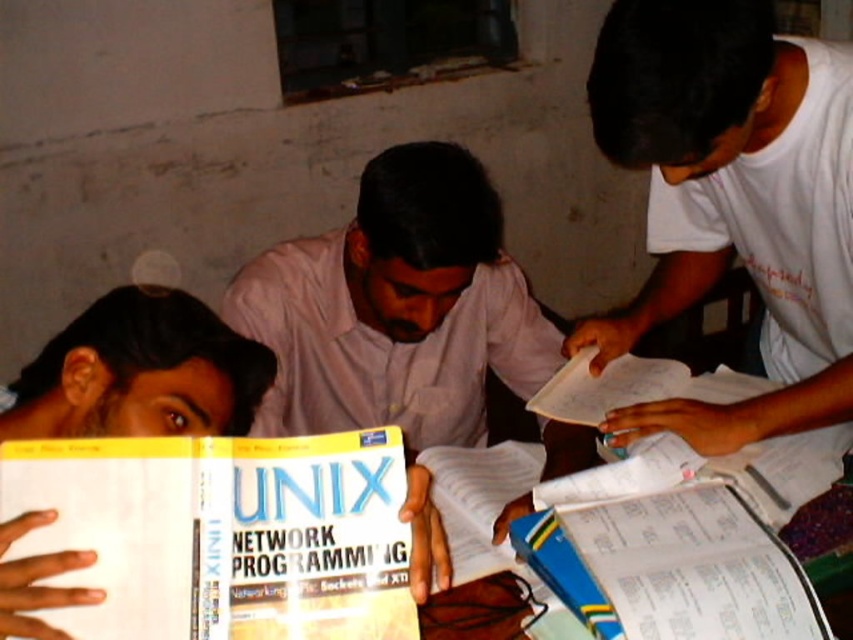
You are a photographer trying to capture the scene of the study session. You want to ensure that both the white matte shirt at upper right and the white paper book at center are clearly visible in your photo. Based on their positions, which object should you focus on first to ensure both are in frame?

The white matte shirt at upper right is positioned on the right side of the white paper book at center. Therefore, focusing on the white paper book at center first will ensure both objects remain in frame as the shirt is to its right.

You are a student sitting at a desk and you want to reach for the yellow paperback book at center. Can you comfortably reach it without moving your chair?

The yellow paperback book at center is 25.27 inches away from the viewer. Since the average comfortable reaching distance is about 22 inches, you may need to move your chair slightly closer to comfortably reach it.